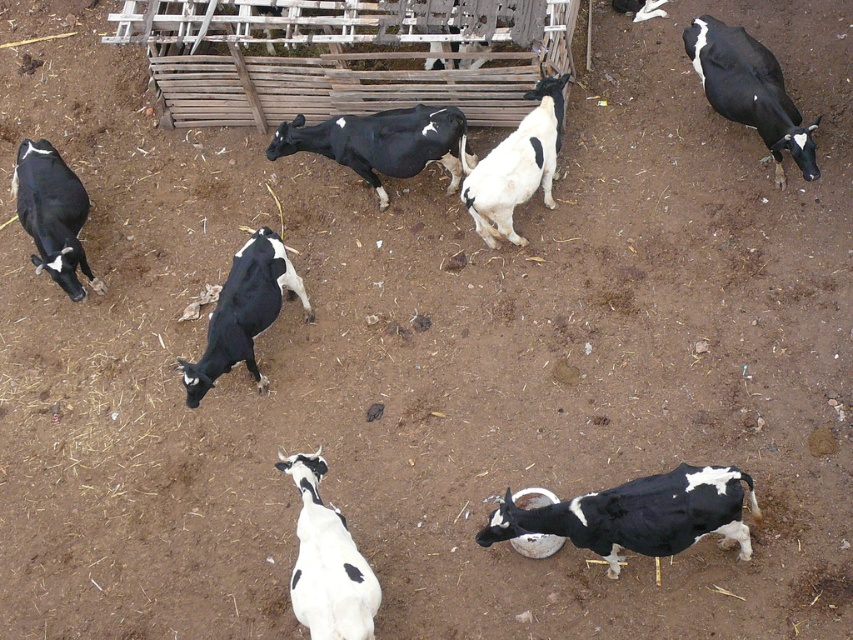
Question: Based on their relative distances, which object is nearer to the black glossy cow at left?

Choices:
 (A) black glossy cow at center
 (B) white woolen goat at center
 (C) black and white spotted cow at center
 (D) black glossy cow at upper right

Answer: (C)

Question: Estimate the real-world distances between objects in this image. Which object is farther from the black glossy cow at upper right?

Choices:
 (A) black and white spotted goat at lower center
 (B) black glossy cow at center
 (C) white matte/goat at center

Answer: (C)

Question: Among these objects, which one is farthest from the camera?

Choices:
 (A) black glossy cow at center
 (B) black and white spotted goat at lower center
 (C) black glossy cow at upper right
 (D) black and white spotted cow at center

Answer: (A)

Question: Is black and white spotted goat at lower center bigger than black glossy cow at upper right?

Choices:
 (A) yes
 (B) no

Answer: (A)

Question: Does black glossy cow at center appear on the right side of white matte/goat at center?

Choices:
 (A) yes
 (B) no

Answer: (A)

Question: Is black and white spotted goat at lower center thinner than white woolen goat at center?

Choices:
 (A) no
 (B) yes

Answer: (A)